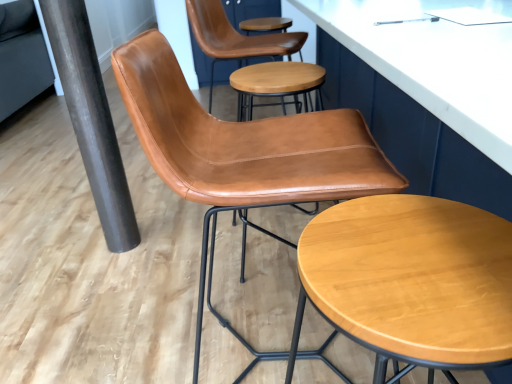
At what (x,y) coordinates should I click in order to perform the action: click on free spot to the left of black metallic pole at lower left. Please return your answer as a coordinate pair (x, y). This screenshot has width=512, height=384. Looking at the image, I should click on (80, 244).